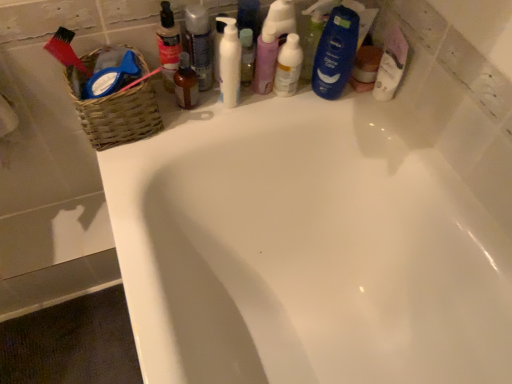
I want to click on blank space to the left of white glossy bottle at upper center, so [217, 102].